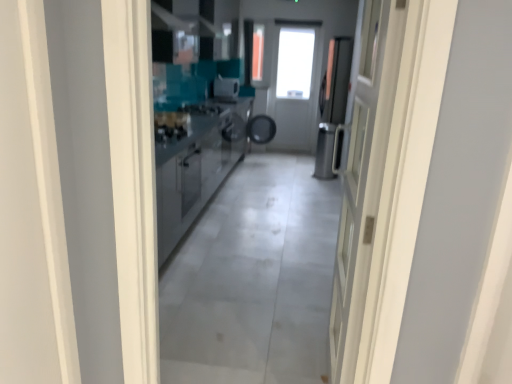
Question: Considering the relative sizes of satin silver toaster at center and stainless steel cabinetry at center in the image provided, is satin silver toaster at center bigger than stainless steel cabinetry at center?

Choices:
 (A) yes
 (B) no

Answer: (B)

Question: From the image's perspective, is satin silver toaster at center under stainless steel cabinetry at center?

Choices:
 (A) no
 (B) yes

Answer: (A)

Question: From a real-world perspective, is satin silver toaster at center under stainless steel cabinetry at center?

Choices:
 (A) no
 (B) yes

Answer: (A)

Question: Does satin silver toaster at center have a greater width compared to stainless steel cabinetry at center?

Choices:
 (A) yes
 (B) no

Answer: (B)

Question: From a real-world perspective, is satin silver toaster at center on top of stainless steel cabinetry at center?

Choices:
 (A) yes
 (B) no

Answer: (A)

Question: Is satin silver toaster at center at the right side of stainless steel cabinetry at center?

Choices:
 (A) yes
 (B) no

Answer: (A)

Question: From the image's perspective, would you say white glossy door at right is positioned over satin silver dishwasher at center?

Choices:
 (A) yes
 (B) no

Answer: (B)

Question: Is satin silver dishwasher at center located within white glossy door at right?

Choices:
 (A) yes
 (B) no

Answer: (B)

Question: Does white glossy door at right have a greater width compared to satin silver dishwasher at center?

Choices:
 (A) yes
 (B) no

Answer: (B)

Question: Does white glossy door at right have a larger size compared to satin silver dishwasher at center?

Choices:
 (A) no
 (B) yes

Answer: (B)

Question: Are white glossy door at right and satin silver dishwasher at center located far from each other?

Choices:
 (A) yes
 (B) no

Answer: (A)

Question: Could you tell me if white glossy door at right is turned towards satin silver dishwasher at center?

Choices:
 (A) no
 (B) yes

Answer: (A)

Question: From a real-world perspective, does stainless steel cabinetry at center stand above satin silver toaster at center?

Choices:
 (A) yes
 (B) no

Answer: (B)